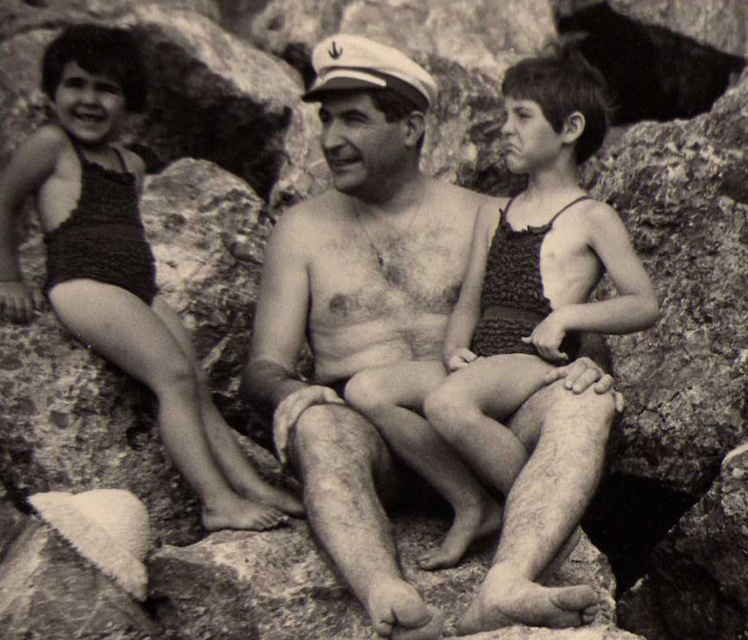
You are standing in front of the photograph and want to determine the relative positions of two points marked on it. Which point is closer to you, point (393, 230) or point (114, 100)?

Point (393, 230) is further to the viewer than point (114, 100), so point (114, 100) is closer to you.

Based on the scene described, what is located at the coordinate point (401, 358)?

The smooth skin man at center is located at point (401, 358).

Consider the image. Please describe the position of the smooth skin man at center in terms of coordinates in the image. The image has a coordinate system where the bottom left corner is at point 0,0 and the top right corner is at 1,1. Please provide the coordinates as a pair of numbers between 0 and 1 separated by a comma.

The smooth skin man at center is located at coordinates (401, 358).